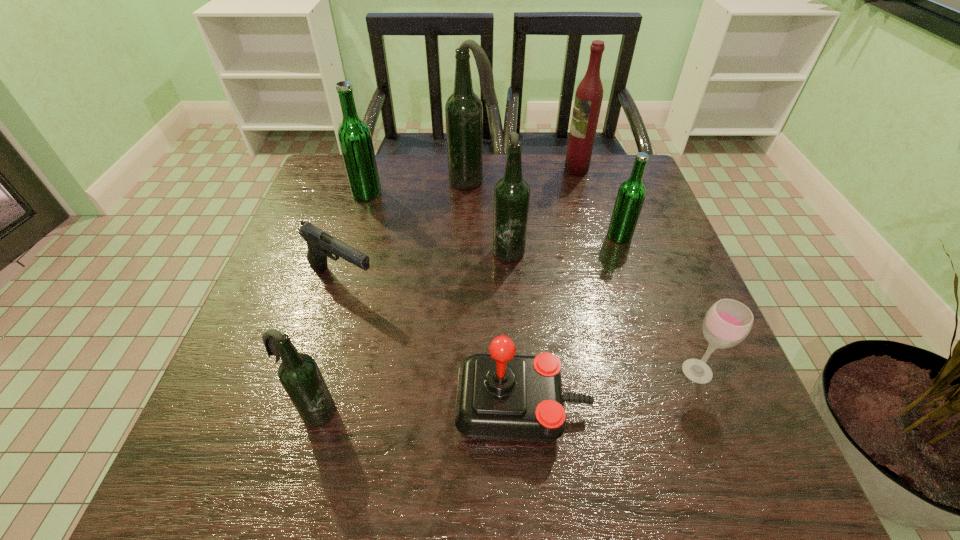
The image size is (960, 540). Identify the location of vacant region located on the left of the right green beer bottle. (477, 236).

At what (x,y) coordinates should I click in order to perform the action: click on free space located 0.090m on the front of the nearest dark beer bottle. Please return your answer as a coordinate pair (x, y). This screenshot has height=540, width=960. Looking at the image, I should click on (294, 483).

Find the location of `free point located on the right of the red joystick`. free point located on the right of the red joystick is located at coordinates (692, 407).

Where is `free space located on the back of the wineglass`? free space located on the back of the wineglass is located at coordinates (665, 290).

Where is `vacant point located at the muzzle of the shortest object`? The image size is (960, 540). vacant point located at the muzzle of the shortest object is located at coordinates (455, 281).

Where is `liquor that is positioned at the far edge`? liquor that is positioned at the far edge is located at coordinates pos(589,94).

Identify the location of object positioned at the near edge. The height and width of the screenshot is (540, 960). (501, 396).

What are the coordinates of `gun at the left edge` in the screenshot? It's located at (320, 244).

Where is `liquor located in the right edge section of the desktop`? liquor located in the right edge section of the desktop is located at coordinates (589, 94).

At what (x,y) coordinates should I click in order to perform the action: click on beer bottle present at the right edge. Please return your answer as a coordinate pair (x, y). Looking at the image, I should click on (631, 194).